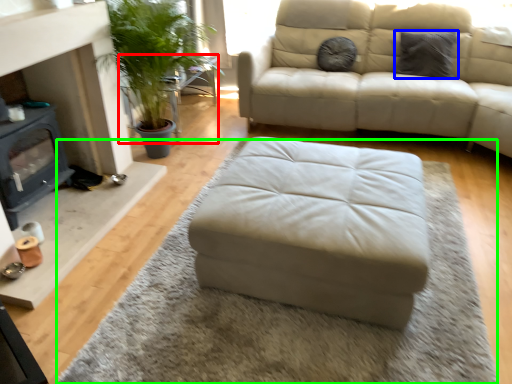
Question: Based on their relative distances, which object is farther from table (highlighted by a red box)? Choose from pillow (highlighted by a blue box) and mat (highlighted by a green box).

Choices:
 (A) pillow
 (B) mat

Answer: (B)